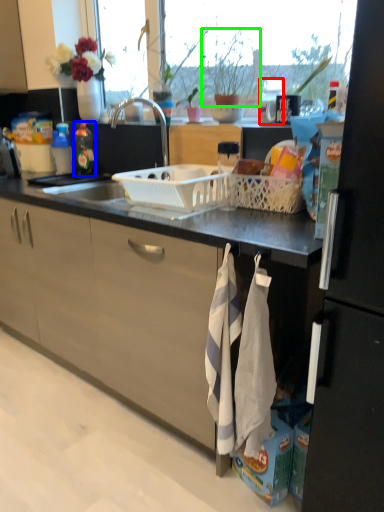
Question: Which is nearer to the appliance (highlighted by a red box)? kitchen appliance (highlighted by a blue box) or houseplant (highlighted by a green box).

Choices:
 (A) kitchen appliance
 (B) houseplant

Answer: (B)